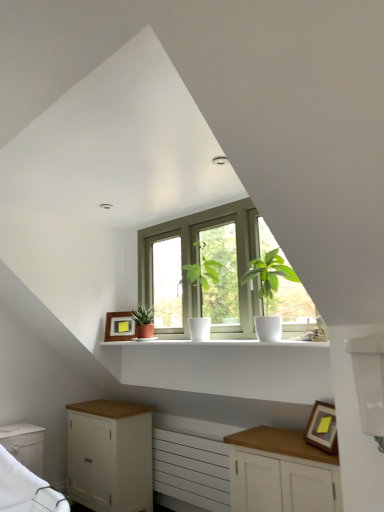
Image resolution: width=384 pixels, height=512 pixels. I want to click on free point above green matte window at center (from a real-world perspective), so click(196, 214).